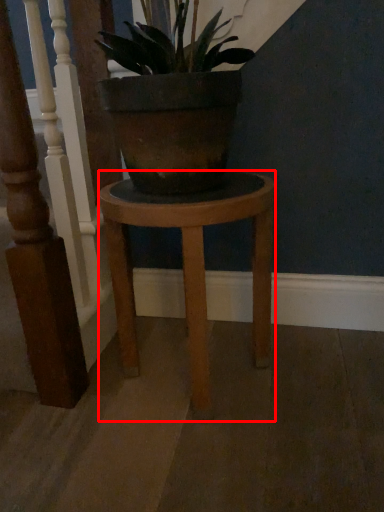
Question: Observing the image, what is the correct spatial positioning of stool (annotated by the red box) in reference to rail?

Choices:
 (A) right
 (B) left

Answer: (A)